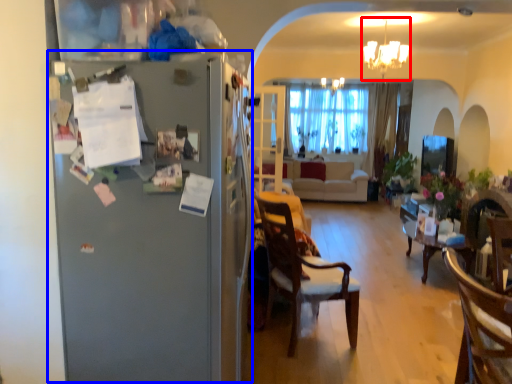
Question: Which of the following is the farthest to the observer, light fixture (highlighted by a red box) or fridge (highlighted by a blue box)?

Choices:
 (A) light fixture
 (B) fridge

Answer: (A)